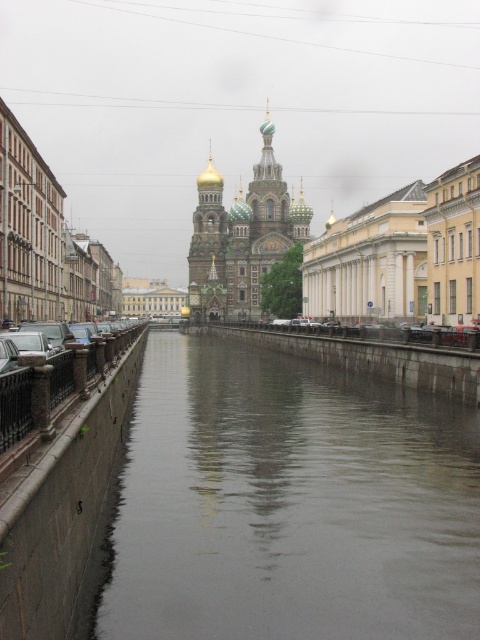
You are standing on the left side of the canal and want to take a photo of the golden domed cathedral at center. Which direction should you turn to ensure the smooth concrete river at center is visible to the right of the cathedral in your photo?

You should turn to your right because the smooth concrete river at center is positioned to the right of the golden domed cathedral at center, so turning right will align the cathedral with the river in that direction.

You are a tourist standing on the left bank of the canal. You want to take a photo of the golden domed cathedral at center without any obstructions. Is the smooth concrete river at center blocking your view of the cathedral?

The smooth concrete river at center is in front of the golden domed cathedral at center, so it is blocking your view of the cathedral.